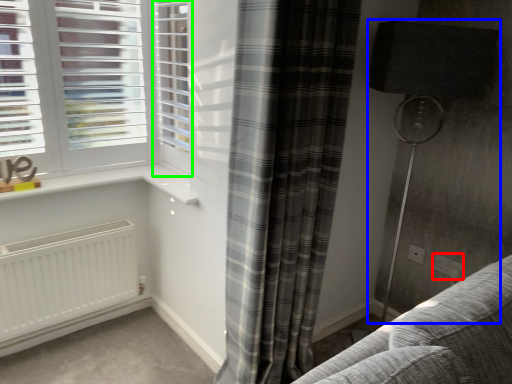
Question: Which object is the farthest from electric outlet (highlighted by a red box)? Choose among these: lamp (highlighted by a blue box) or screen door (highlighted by a green box).

Choices:
 (A) lamp
 (B) screen door

Answer: (B)